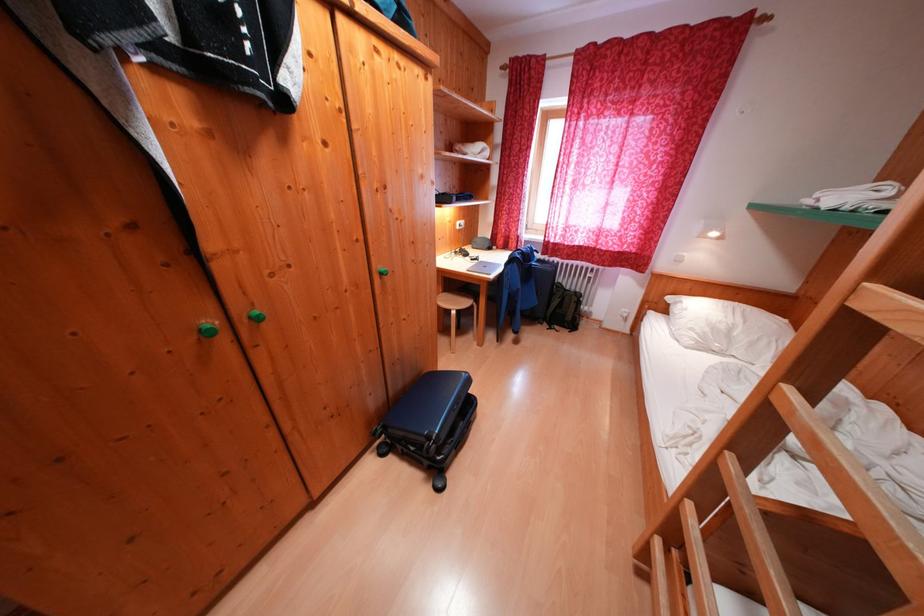
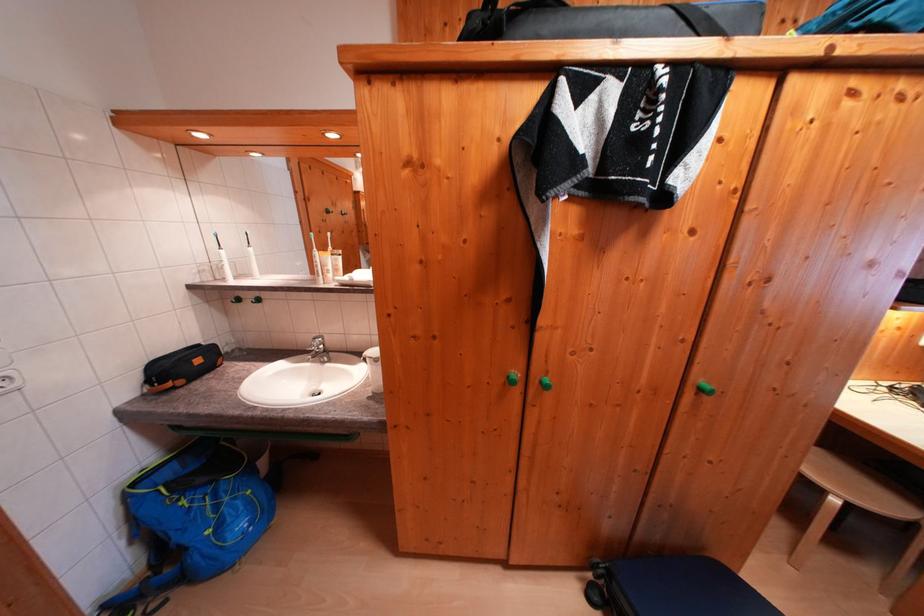
Find the pixel in the second image that matches point 259,323 in the first image.

(550, 387)